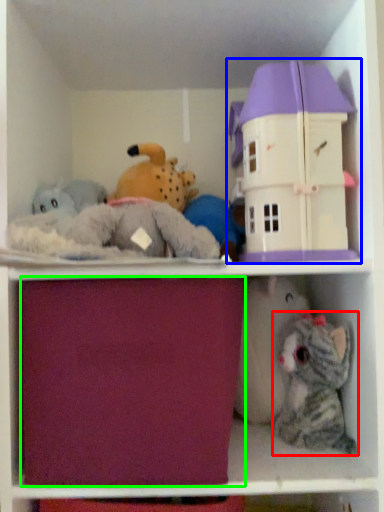
Question: Which object is positioned closest to toy (highlighted by a red box)? Select from toy (highlighted by a blue box) and drawer (highlighted by a green box).

Choices:
 (A) toy
 (B) drawer

Answer: (A)